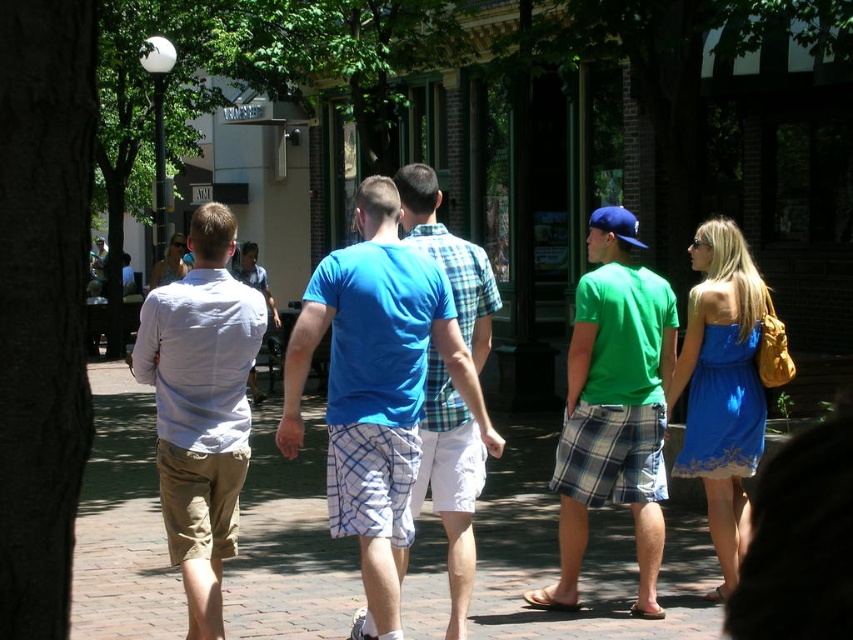
Question: Estimate the real-world distances between objects in this image. Which object is closer to the brown brick pavement at center?

Choices:
 (A) green plaid shorts at center
 (B) white cotton shirt at left

Answer: (A)

Question: Which of the following is the closest to the observer?

Choices:
 (A) (657, 541)
 (B) (370, 355)

Answer: (B)

Question: Does blue cotton t-shirt at center appear under white cotton shirt at left?

Choices:
 (A) no
 (B) yes

Answer: (A)

Question: Considering the relative positions of brown brick pavement at center and blue cotton t-shirt at center in the image provided, where is brown brick pavement at center located with respect to blue cotton t-shirt at center?

Choices:
 (A) above
 (B) below

Answer: (B)

Question: Which of these objects is positioned closest to the green plaid shorts at center?

Choices:
 (A) white cotton shirt at left
 (B) brown brick pavement at center
 (C) blue cotton t-shirt at center

Answer: (C)

Question: Is brown brick pavement at center positioned before blue cotton t-shirt at center?

Choices:
 (A) yes
 (B) no

Answer: (B)